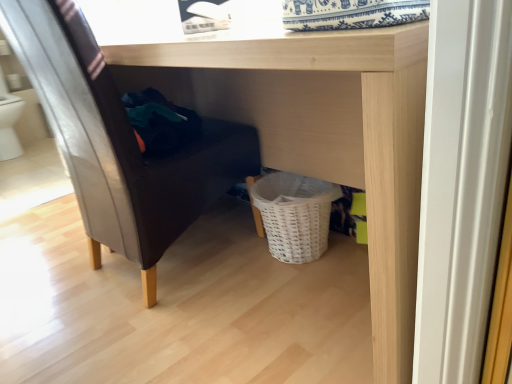
The width and height of the screenshot is (512, 384). In order to click on vacant region below wooden table at center (from a real-world perspective) in this screenshot , I will do `click(297, 288)`.